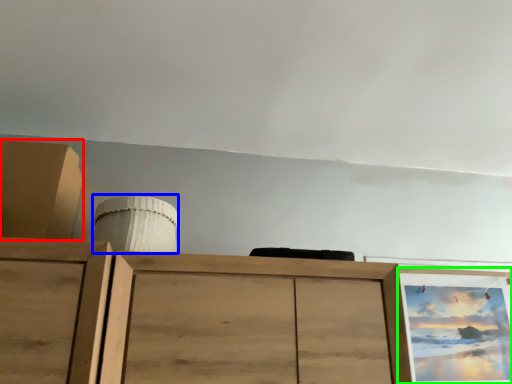
Question: Which object is the farthest from cabinetry (highlighted by a red box)? Choose among these: job (highlighted by a blue box) or picture frame (highlighted by a green box).

Choices:
 (A) job
 (B) picture frame

Answer: (B)